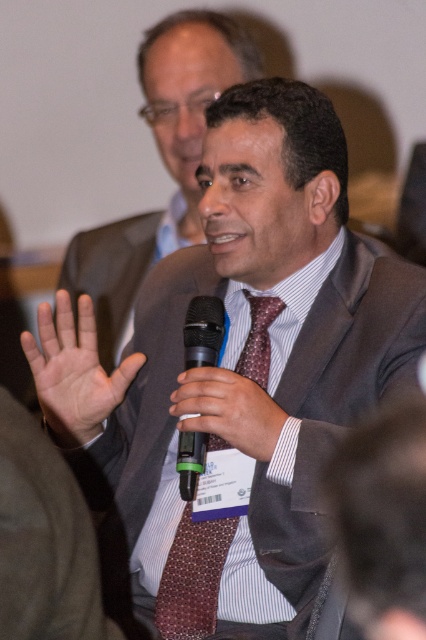
At what (x,y) coordinates should I click in order to perform the action: click on dark gray textured suit at center. Please return your answer as a coordinate pair (x, y). Looking at the image, I should click on (319, 413).

From the picture: Is dark gray textured suit at center positioned at the back of smooth skin hand at center?

No, it is in front of smooth skin hand at center.

Between point (134, 547) and point (57, 442), which one is positioned in front?

Point (57, 442) is in front.

This screenshot has width=426, height=640. I want to click on dark gray textured suit at center, so click(x=319, y=413).

The width and height of the screenshot is (426, 640). Find the location of `smooth skin hand at center`. smooth skin hand at center is located at coordinates (74, 371).

Between smooth skin hand at center and black matte microphone at center, which one is positioned lower?

black matte microphone at center

What do you see at coordinates (74, 371) in the screenshot?
I see `smooth skin hand at center` at bounding box center [74, 371].

The image size is (426, 640). I want to click on smooth skin hand at center, so click(74, 371).

Is maroon textured tie at center closer to the viewer compared to black plastic microphone at center?

No, maroon textured tie at center is further to the viewer.

Does maroon textured tie at center have a lesser height compared to black plastic microphone at center?

No, maroon textured tie at center is not shorter than black plastic microphone at center.

What do you see at coordinates (192, 577) in the screenshot?
I see `maroon textured tie at center` at bounding box center [192, 577].

Where is `maroon textured tie at center`? The height and width of the screenshot is (640, 426). maroon textured tie at center is located at coordinates (192, 577).